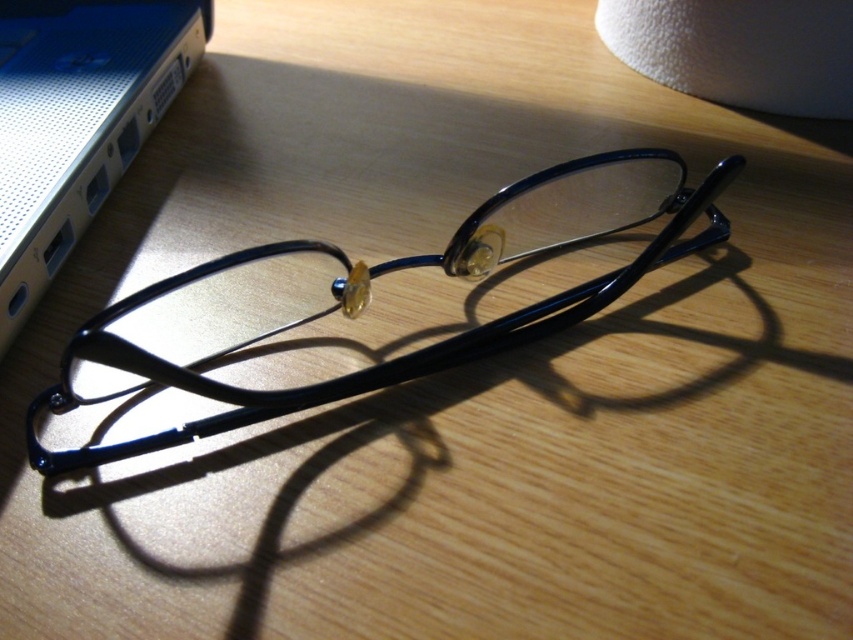
You are organizing your desk and want to place a new item between the glossy plastic glasses at center and the satin silver laptop at upper left. Based on their current positions, where should you place the new item to ensure it is between them?

The new item should be placed to the right of the satin silver laptop at upper left and to the left of the glossy plastic glasses at center, as the glasses are positioned to the right of the laptop.

You are organizing items on a desk and need to move the satin silver laptop at upper left closer to you. The glossy plastic glasses at center are currently in the way. Can you slide the glasses out of the way without moving the laptop?

The glossy plastic glasses at center are in front of the satin silver laptop at upper left, so you can slide them forward away from the laptop to make space to move the laptop closer to you.

You are organizing items on a desk and need to stack the glossy plastic glasses at center and the satin silver laptop at upper left. Which item should you place at the bottom to ensure stability?

The glossy plastic glasses at center has a lesser height compared to the satin silver laptop at upper left, so placing the taller satin silver laptop at upper left at the bottom would provide a more stable base for stacking.